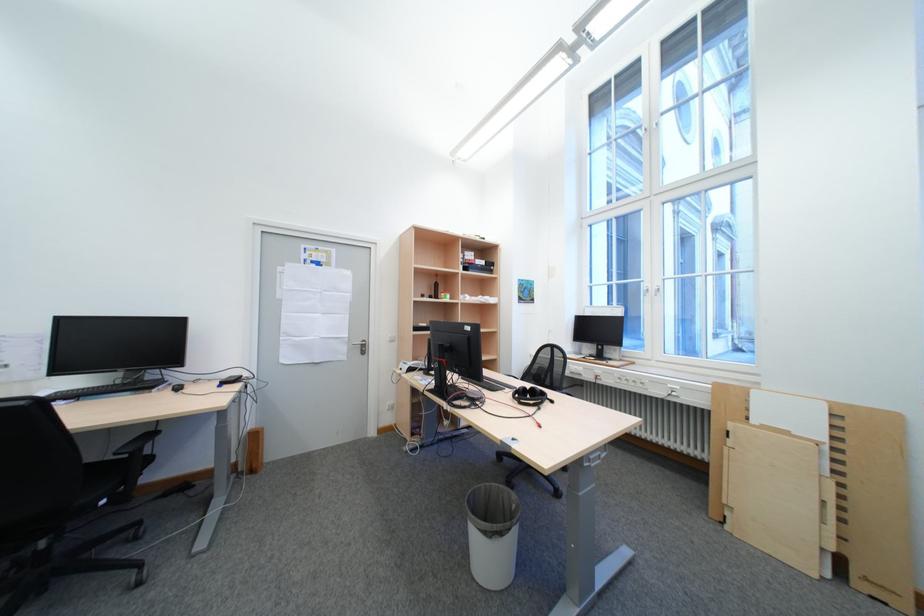
Which object does [481,265] point to?

It refers to a black binder.